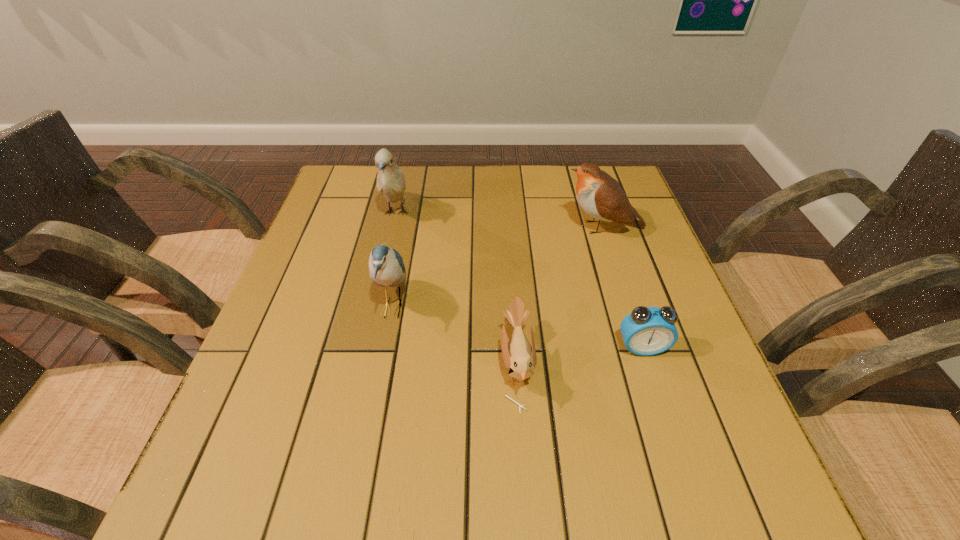
Locate an element on the screen. empty location between the shortest bird and the rightmost bird is located at coordinates (560, 296).

Where is `vacant area that lies between the shortest bird and the rightmost bird`? This screenshot has width=960, height=540. vacant area that lies between the shortest bird and the rightmost bird is located at coordinates (560, 296).

Where is `vacant area between the third object from left to right and the rightmost bird`? This screenshot has height=540, width=960. vacant area between the third object from left to right and the rightmost bird is located at coordinates (560, 296).

Select which object appears as the third closest to the third bird from left to right. Please provide its 2D coordinates. Your answer should be formatted as a tuple, i.e. [(x, y)], where the tuple contains the x and y coordinates of a point satisfying the conditions above.

[(602, 197)]

Locate which object ranks in proximity to the alarm clock. Please provide its 2D coordinates. Your answer should be formatted as a tuple, i.e. [(x, y)], where the tuple contains the x and y coordinates of a point satisfying the conditions above.

[(519, 356)]

Locate an element on the screen. This screenshot has height=540, width=960. bird that is the closest to the rightmost bird is located at coordinates (519, 356).

This screenshot has height=540, width=960. I want to click on bird that stands as the third closest to the third bird from left to right, so pos(390,180).

The width and height of the screenshot is (960, 540). In order to click on vacant point that satisfies the following two spatial constraints: 1. at the face of the rightmost bird; 2. on the face of the alarm clock in this screenshot , I will do `click(642, 348)`.